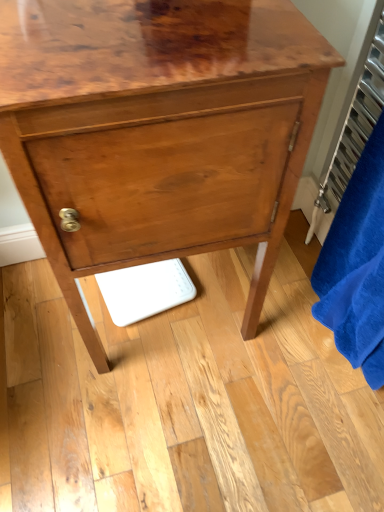
Image resolution: width=384 pixels, height=512 pixels. Find the location of `free space between glossy wood chest of drawers at center and blue plush bath towel at right`. free space between glossy wood chest of drawers at center and blue plush bath towel at right is located at coordinates (266, 347).